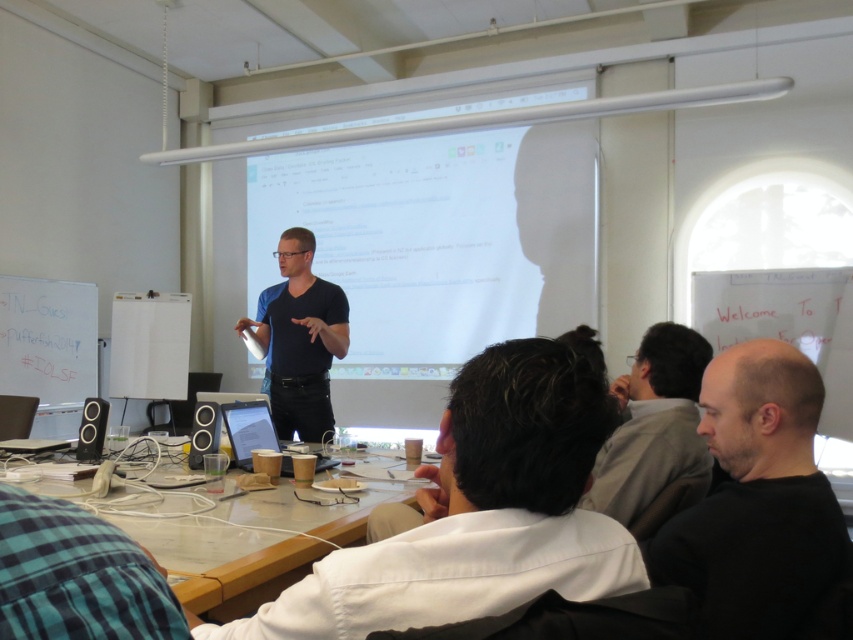
Question: Can you confirm if gray fabric shirt at center is positioned below black matte shirt at center?

Choices:
 (A) yes
 (B) no

Answer: (A)

Question: Which point is farther to the camera?

Choices:
 (A) gray fabric shirt at center
 (B) black matte shirt at center
 (C) black matte shirt at lower right

Answer: (B)

Question: Can you confirm if white cotton shirt at center is positioned below black matte shirt at center?

Choices:
 (A) no
 (B) yes

Answer: (B)

Question: Is white matte projection screen at upper center smaller than black matte shirt at center?

Choices:
 (A) yes
 (B) no

Answer: (B)

Question: Which is farther from the white cotton shirt at center?

Choices:
 (A) gray fabric shirt at center
 (B) wooden table at lower center
 (C) black matte shirt at lower right

Answer: (A)

Question: Estimate the real-world distances between objects in this image. Which object is farther from the black matte shirt at center?

Choices:
 (A) wooden table at lower center
 (B) white cotton shirt at center

Answer: (B)